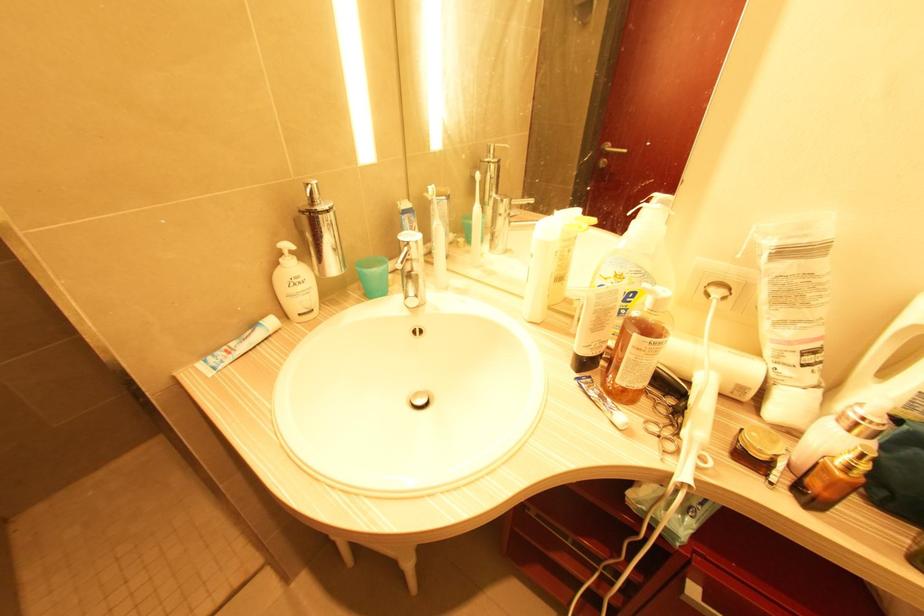
Find the location of `brown bottle pump`. brown bottle pump is located at coordinates (833, 477).